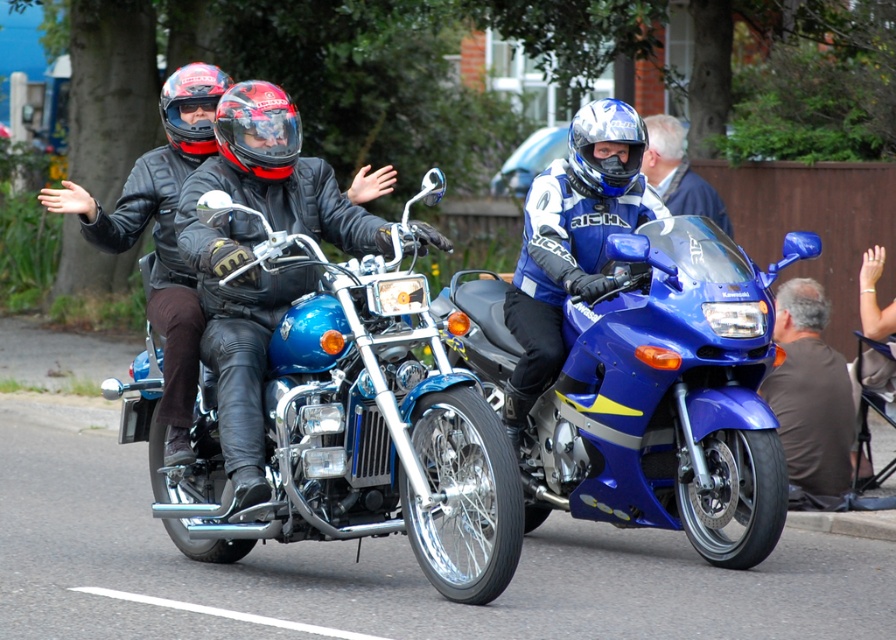
You are a pedestrian standing at the point marked as point (681, 134). You see two motorcyclists riding side by side on a paved road. The first rider is on a blue cruiser motorcycle with chrome details and wearing a black leather jacket and red and black helmet. The passenger is also in black leather and a matching helmet. The second rider is on a sportier blue motorcycle ahead and to the right. How far apart are the two motorcyclists from each other?

The two motorcyclists are 45.63 feet apart.

You are a photographer standing on the sidewalk. You want to take a photo of the blue leather jacket at center and the matte black helmet at upper center. Which object should you focus on first if you want to capture both in the same frame without moving the camera?

The blue leather jacket at center is positioned on the right side of matte black helmet at upper center, so you should focus on the matte black helmet at upper center first to ensure both are in the frame.